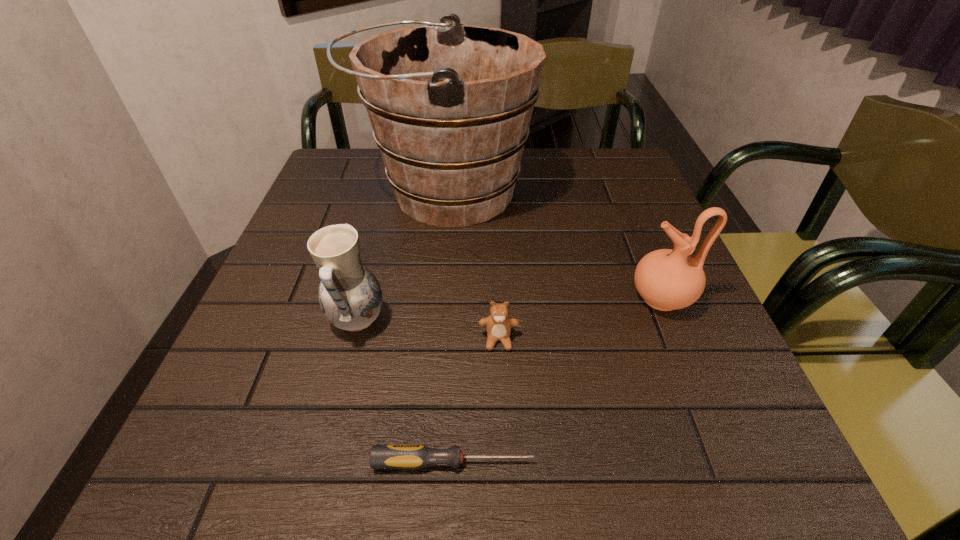
You are a GUI agent. You are given a task and a screenshot of the screen. Output one action in this format:
    pyautogui.click(x=<x>, y=<y>)
    Task: Click on the object at the far left corner
    
    Given the screenshot: What is the action you would take?
    (x=450, y=105)

Locate an element on the screen. vacant region at the near edge of the desktop is located at coordinates (486, 461).

The height and width of the screenshot is (540, 960). In order to click on vacant space at the left edge of the desktop in this screenshot , I will do `click(312, 201)`.

The width and height of the screenshot is (960, 540). In the image, there is a desktop. In order to click on vacant region at the right edge in this screenshot , I will do `click(738, 426)`.

Where is `vacant space at the near left corner of the desktop`? Image resolution: width=960 pixels, height=540 pixels. vacant space at the near left corner of the desktop is located at coordinates (198, 471).

You are a GUI agent. You are given a task and a screenshot of the screen. Output one action in this format:
    pyautogui.click(x=<x>, y=<y>)
    Task: Click on the vacant space at the far right corner of the desktop
    The image size is (960, 540).
    Given the screenshot: What is the action you would take?
    pyautogui.click(x=598, y=183)

At what (x,y) coordinates should I click in order to perform the action: click on empty location between the second shortest object and the tallest object. Please return your answer as a coordinate pair (x, y). Image resolution: width=960 pixels, height=540 pixels. Looking at the image, I should click on [471, 265].

The width and height of the screenshot is (960, 540). Find the location of `empty space that is in between the fourth tallest object and the bucket`. empty space that is in between the fourth tallest object and the bucket is located at coordinates (471, 265).

This screenshot has height=540, width=960. I want to click on empty space between the left pottery and the teddy bear, so click(x=428, y=330).

Find the location of a particular element. Image resolution: width=960 pixels, height=540 pixels. free space between the tallest object and the left pottery is located at coordinates (401, 256).